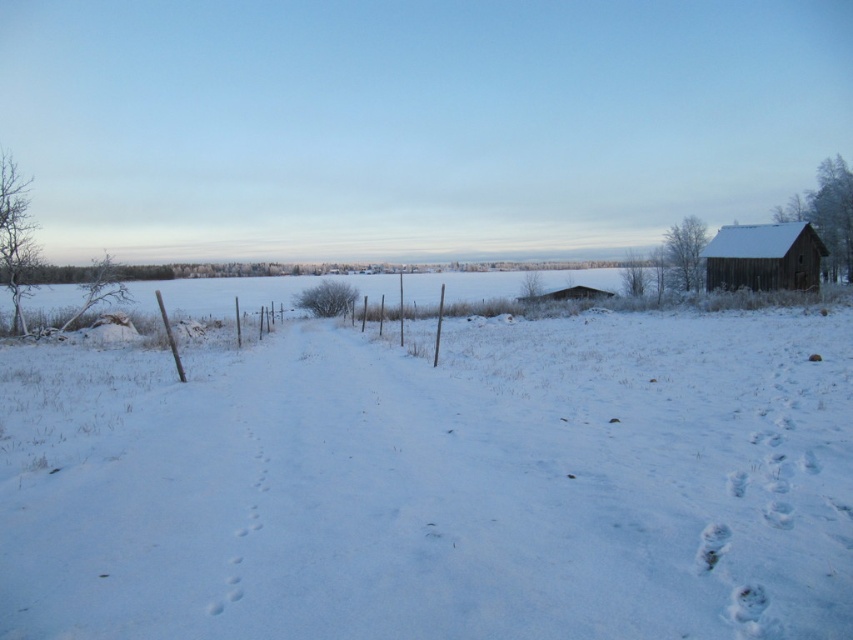
In the scene shown: Which of these two, white fluffy snow at center or wooden barn at right, stands taller?

Standing taller between the two is wooden barn at right.

Is white fluffy snow at center shorter than wooden barn at right?

Yes, white fluffy snow at center is shorter than wooden barn at right.

Identify the location of white fluffy snow at center. (438, 484).